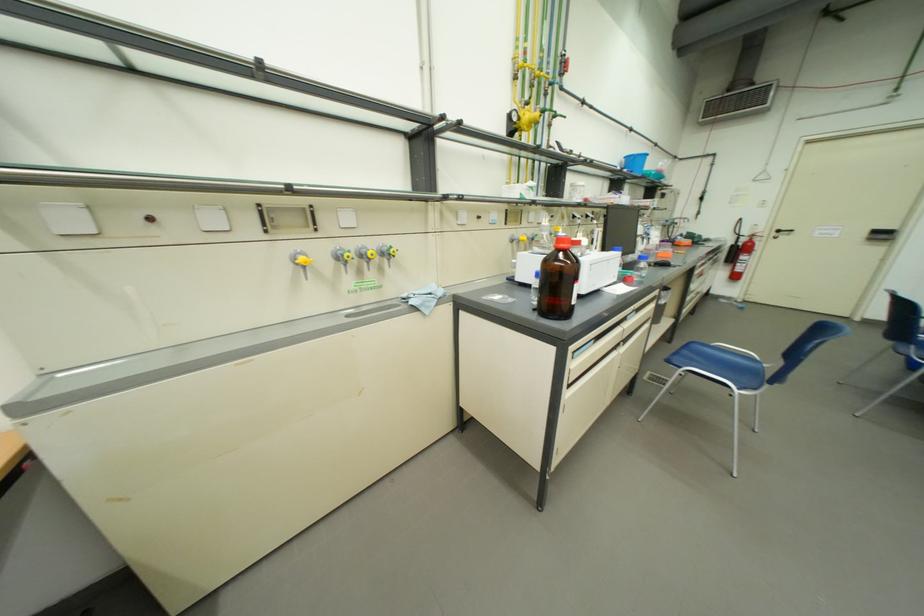
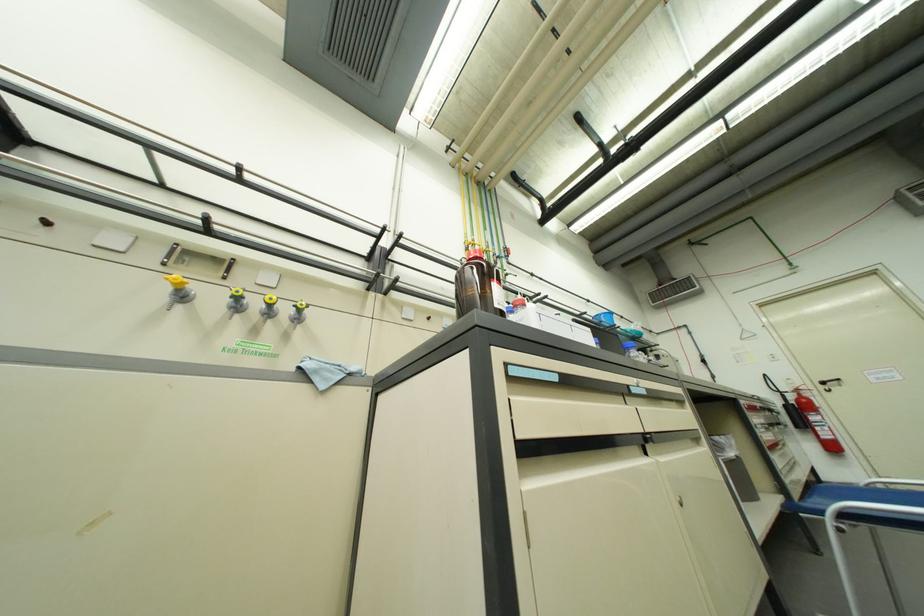
Question: The images are taken continuously from a first-person perspective. In which direction is your viewpoint rotating?

Choices:
 (A) Left
 (B) Right
 (C) Up
 (D) Down

Answer: (C)